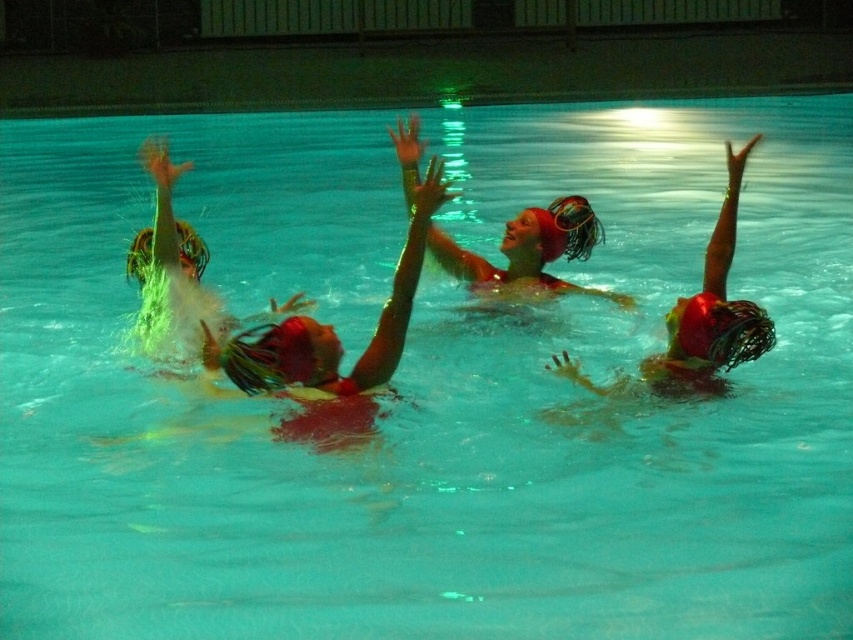
You are a photographer positioned at the edge of the pool. You want to take a photo that includes both the point at (294,376) and the point at (740,166). Which point should be closer to the camera to ensure both are in focus?

Point (294,376) is in front of point (740,166), so to ensure both are in focus, the photographer should have the point at (294,376) closer to the camera.

You are a photographer at the edge of the pool. You want to capture a photo where both the matte red swim cap at center and the green matte hair at upper right are clearly visible. Which object should you focus on first to ensure both are in frame?

You should focus on the matte red swim cap at center first because it is wider than the green matte hair at upper right, ensuring it fits within the frame while still capturing the smaller object.